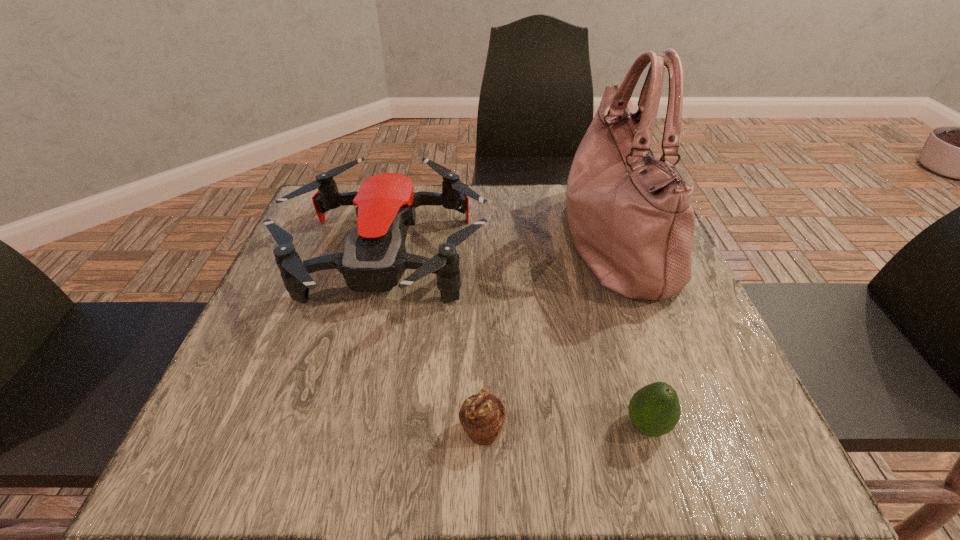
The width and height of the screenshot is (960, 540). Identify the location of vacant space at the far edge of the desktop. (443, 211).

This screenshot has width=960, height=540. Identify the location of vacant point at the near edge. (359, 427).

Identify the location of vacant area at the right edge of the desktop. (667, 308).

At what (x,y) coordinates should I click in order to perform the action: click on free region at the near left corner of the desktop. Please return your answer as a coordinate pair (x, y). Looking at the image, I should click on (195, 467).

Image resolution: width=960 pixels, height=540 pixels. Find the location of `blank area at the near right corner`. blank area at the near right corner is located at coordinates (699, 463).

You are a GUI agent. You are given a task and a screenshot of the screen. Output one action in this format:
    pyautogui.click(x=<x>, y=<y>)
    Task: Click on the free spot between the drone and the avocado
    The width and height of the screenshot is (960, 540).
    Given the screenshot: What is the action you would take?
    pyautogui.click(x=516, y=342)

You are a GUI agent. You are given a task and a screenshot of the screen. Output one action in this format:
    pyautogui.click(x=<x>, y=<y>)
    Task: Click on the vacant space that is in between the avocado and the third shortest object
    
    Given the screenshot: What is the action you would take?
    pyautogui.click(x=516, y=342)

This screenshot has height=540, width=960. Find the location of `vacant region between the muffin and the drone`. vacant region between the muffin and the drone is located at coordinates (434, 345).

Image resolution: width=960 pixels, height=540 pixels. I want to click on vacant area that lies between the drone and the avocado, so [x=516, y=342].

In order to click on vacant space that's between the avocado and the drone in this screenshot , I will do `click(516, 342)`.